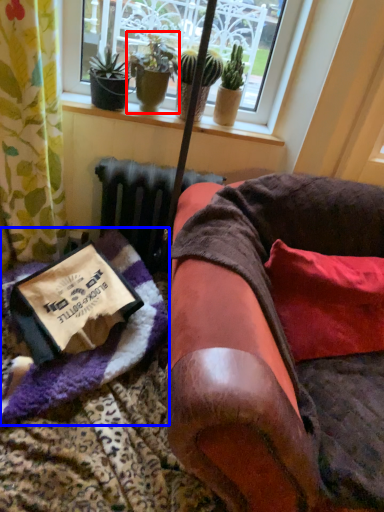
Question: Which point is closer to the camera, houseplant (highlighted by a red box) or blanket (highlighted by a blue box)?

Choices:
 (A) houseplant
 (B) blanket

Answer: (B)